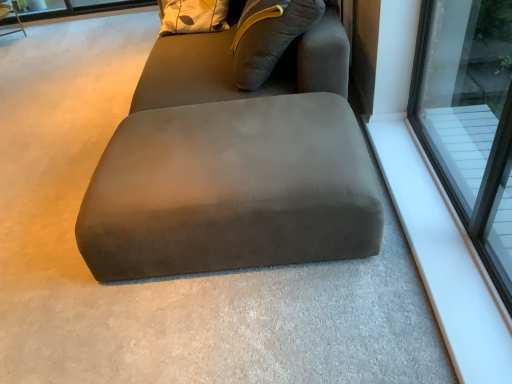
Locate an element on the screen. vacant point above suede ottoman at center (from a real-world perspective) is located at coordinates (220, 134).